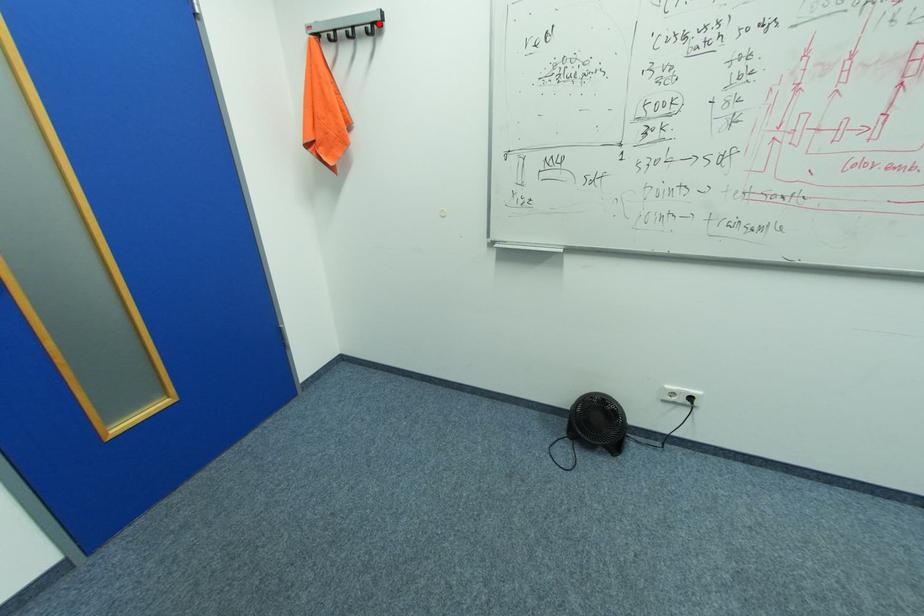
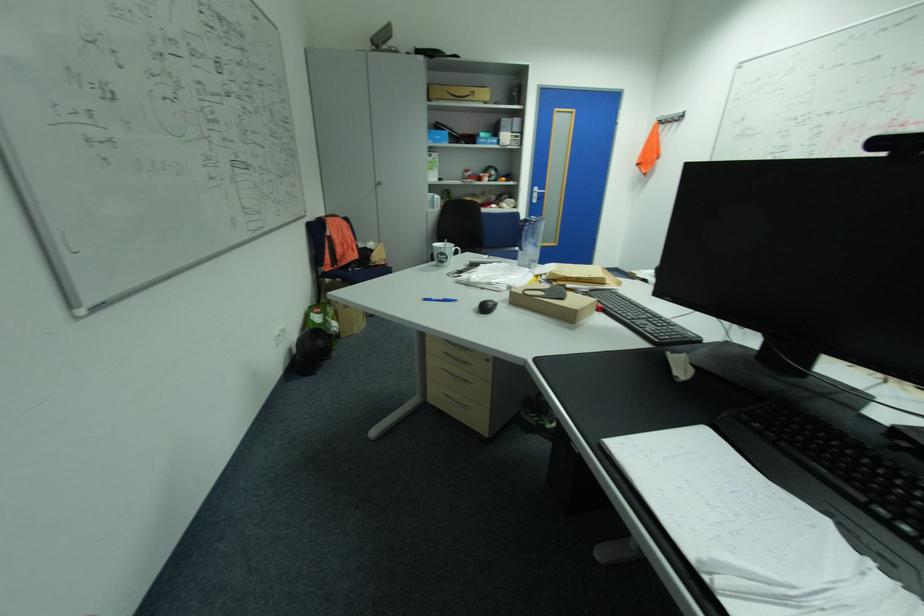
Question: I am providing you with two images of the same scene from different viewpoints. A red point is marked on the first image. Is the red point's position out of view in image 2?

Choices:
 (A) Yes
 (B) No

Answer: (A)